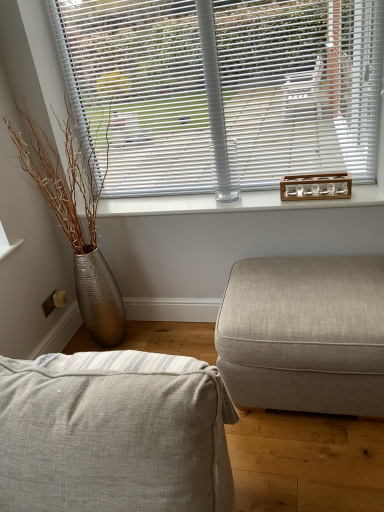
Question: In which direction should I rotate to look at textured beige fabric couch at lower center, the second studio couch positioned from the right?

Choices:
 (A) right
 (B) left

Answer: (B)

Question: From a real-world perspective, is textured beige ottoman at right, which ranks as the first studio couch in back-to-front order, on top of textured beige fabric couch at lower center, which is counted as the second studio couch, starting from the back?

Choices:
 (A) yes
 (B) no

Answer: (B)

Question: Would you say textured beige fabric couch at lower center, which is the 1th studio couch in front-to-back order, is part of textured beige ottoman at right, acting as the 2th studio couch starting from the left,'s contents?

Choices:
 (A) yes
 (B) no

Answer: (B)

Question: Is textured beige ottoman at right, marked as the first studio couch in a right-to-left arrangement, facing away from textured beige fabric couch at lower center, which is the 1th studio couch in front-to-back order?

Choices:
 (A) yes
 (B) no

Answer: (B)

Question: Is textured beige ottoman at right, arranged as the second studio couch when viewed from the front, thinner than textured beige fabric couch at lower center, the second studio couch positioned from the right?

Choices:
 (A) no
 (B) yes

Answer: (A)

Question: Could you tell me if textured beige ottoman at right, marked as the first studio couch in a right-to-left arrangement, is turned towards textured beige fabric couch at lower center, which appears as the first studio couch when viewed from the left?

Choices:
 (A) yes
 (B) no

Answer: (A)

Question: Is textured beige ottoman at right, acting as the 2th studio couch starting from the left, at the left side of textured beige fabric couch at lower center, which is the 1th studio couch in front-to-back order?

Choices:
 (A) no
 (B) yes

Answer: (A)

Question: Does textured beige fabric couch at lower center, which is counted as the second studio couch, starting from the back, come behind clear glass bottle at center?

Choices:
 (A) yes
 (B) no

Answer: (B)

Question: Does textured beige fabric couch at lower center, which appears as the first studio couch when viewed from the left, have a smaller size compared to clear glass bottle at center?

Choices:
 (A) no
 (B) yes

Answer: (A)

Question: From the image's perspective, would you say textured beige fabric couch at lower center, which is the 1th studio couch in front-to-back order, is positioned over clear glass bottle at center?

Choices:
 (A) yes
 (B) no

Answer: (B)

Question: From a real-world perspective, is textured beige fabric couch at lower center, which is the 1th studio couch in front-to-back order, positioned over clear glass bottle at center based on gravity?

Choices:
 (A) no
 (B) yes

Answer: (A)

Question: Would you consider textured beige fabric couch at lower center, which is the 1th studio couch in front-to-back order, to be distant from clear glass bottle at center?

Choices:
 (A) no
 (B) yes

Answer: (B)

Question: Is clear glass bottle at center at the back of textured beige fabric couch at lower center, which appears as the first studio couch when viewed from the left?

Choices:
 (A) no
 (B) yes

Answer: (B)

Question: From the image's perspective, is textured beige ottoman at right, acting as the 2th studio couch starting from the left, under clear glass bottle at center?

Choices:
 (A) no
 (B) yes

Answer: (B)